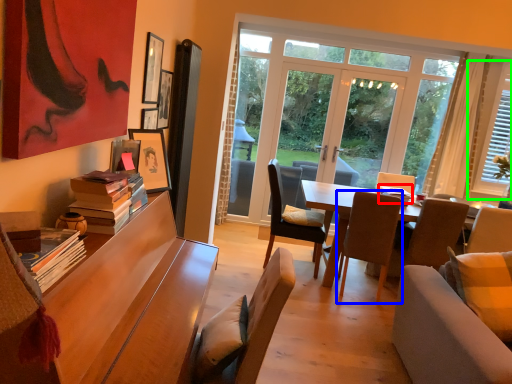
Question: Considering the real-world distances, which object is farthest from book (highlighted by a red box)? chair (highlighted by a blue box) or window (highlighted by a green box)?

Choices:
 (A) chair
 (B) window

Answer: (B)